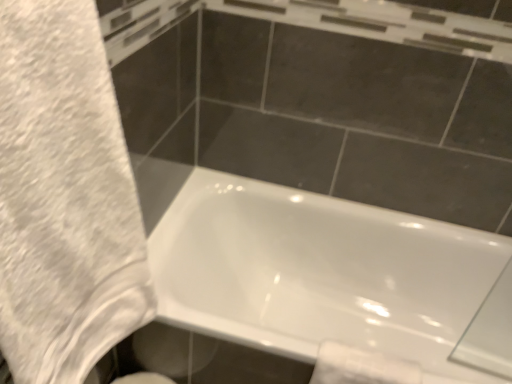
Question: Is white fluffy towel at left not close to white glossy toilet paper at lower right?

Choices:
 (A) yes
 (B) no

Answer: (B)

Question: From a real-world perspective, is white fluffy towel at left physically above white glossy toilet paper at lower right?

Choices:
 (A) yes
 (B) no

Answer: (A)

Question: From the image's perspective, is white fluffy towel at left beneath white glossy toilet paper at lower right?

Choices:
 (A) no
 (B) yes

Answer: (A)

Question: Is the position of white fluffy towel at left less distant than that of white glossy toilet paper at lower right?

Choices:
 (A) yes
 (B) no

Answer: (A)

Question: Can you confirm if white fluffy towel at left is positioned to the right of white glossy toilet paper at lower right?

Choices:
 (A) yes
 (B) no

Answer: (B)

Question: Is white fluffy towel at left bigger or smaller than white glossy toilet paper at lower right?

Choices:
 (A) big
 (B) small

Answer: (A)

Question: From the image's perspective, is white fluffy towel at left located above or below white glossy toilet paper at lower right?

Choices:
 (A) below
 (B) above

Answer: (B)

Question: In terms of width, does white fluffy towel at left look wider or thinner when compared to white glossy toilet paper at lower right?

Choices:
 (A) wide
 (B) thin

Answer: (A)

Question: From a real-world perspective, is white fluffy towel at left above or below white glossy toilet paper at lower right?

Choices:
 (A) above
 (B) below

Answer: (A)

Question: From their relative heights in the image, would you say white glossy toilet paper at lower right is taller or shorter than white fluffy towel at left?

Choices:
 (A) tall
 (B) short

Answer: (B)

Question: Is white glossy toilet paper at lower right bigger or smaller than white fluffy towel at left?

Choices:
 (A) small
 (B) big

Answer: (A)

Question: Is white glossy toilet paper at lower right in front of or behind white fluffy towel at left in the image?

Choices:
 (A) front
 (B) behind

Answer: (B)

Question: From a real-world perspective, is white glossy toilet paper at lower right physically located above or below white fluffy towel at left?

Choices:
 (A) above
 (B) below

Answer: (B)

Question: Is point (357, 380) positioned closer to the camera than point (266, 253)?

Choices:
 (A) closer
 (B) farther

Answer: (A)

Question: Based on their positions, is white glossy toilet paper at lower right located to the left or right of white glossy bathtub at lower center?

Choices:
 (A) left
 (B) right

Answer: (A)